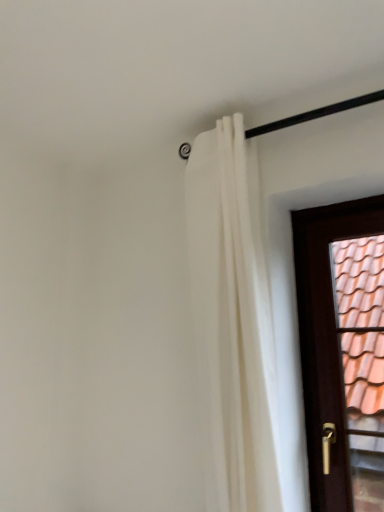
Where is `white fabric curtain at upper center`? Image resolution: width=384 pixels, height=512 pixels. white fabric curtain at upper center is located at coordinates (244, 329).

Describe the element at coordinates (244, 329) in the screenshot. This screenshot has width=384, height=512. I see `white fabric curtain at upper center` at that location.

What is the approximate width of white fabric curtain at upper center?

4.47 inches.

The width and height of the screenshot is (384, 512). In order to click on brown wooden door at right in this screenshot , I will do `click(342, 350)`.

The width and height of the screenshot is (384, 512). What do you see at coordinates (342, 350) in the screenshot?
I see `brown wooden door at right` at bounding box center [342, 350].

The height and width of the screenshot is (512, 384). I want to click on white fabric curtain at upper center, so click(244, 329).

Considering the positions of objects white fabric curtain at upper center and brown wooden door at right in the image provided, who is more to the left, white fabric curtain at upper center or brown wooden door at right?

Positioned to the left is white fabric curtain at upper center.

Does white fabric curtain at upper center come behind brown wooden door at right?

No, it is in front of brown wooden door at right.

Considering the points (279, 361) and (345, 278), which point is in front, point (279, 361) or point (345, 278)?

Positioned in front is point (279, 361).

From the image's perspective, between white fabric curtain at upper center and brown wooden door at right, who is located below?

brown wooden door at right.

From a real-world perspective, which object rests below the other?

brown wooden door at right is physically lower.

Does white fabric curtain at upper center have a greater width compared to brown wooden door at right?

Correct, the width of white fabric curtain at upper center exceeds that of brown wooden door at right.

Who is shorter, white fabric curtain at upper center or brown wooden door at right?

brown wooden door at right is shorter.

Which of these two, white fabric curtain at upper center or brown wooden door at right, is smaller?

Smaller between the two is brown wooden door at right.

Based on the photo, is brown wooden door at right located within white fabric curtain at upper center?

No, brown wooden door at right is not surrounded by white fabric curtain at upper center.

Is white fabric curtain at upper center not close to brown wooden door at right?

Yes.

Does white fabric curtain at upper center turn towards brown wooden door at right?

No, white fabric curtain at upper center is not facing towards brown wooden door at right.

How different are the orientations of white fabric curtain at upper center and brown wooden door at right in degrees?

2.18 degrees separate the facing orientations of white fabric curtain at upper center and brown wooden door at right.

There is a brown wooden door at right. Where is `curtain above it (from a real-world perspective)`? Image resolution: width=384 pixels, height=512 pixels. curtain above it (from a real-world perspective) is located at coordinates (244, 329).

Can you confirm if brown wooden door at right is positioned to the right of white fabric curtain at upper center?

Correct, you'll find brown wooden door at right to the right of white fabric curtain at upper center.

Which object is closer to the camera taking this photo, brown wooden door at right or white fabric curtain at upper center?

white fabric curtain at upper center.

Does point (321, 232) appear closer or farther from the camera than point (267, 240)?

Clearly, point (321, 232) is more distant from the camera than point (267, 240).

From the image's perspective, between brown wooden door at right and white fabric curtain at upper center, which one is located above?

From the image's view, white fabric curtain at upper center is above.

From a real-world perspective, relative to white fabric curtain at upper center, is brown wooden door at right vertically above or below?

Clearly, from a real-world perspective, brown wooden door at right is below white fabric curtain at upper center.

Can you confirm if brown wooden door at right is thinner than white fabric curtain at upper center?

Indeed, brown wooden door at right has a lesser width compared to white fabric curtain at upper center.

Between brown wooden door at right and white fabric curtain at upper center, which one has more height?

white fabric curtain at upper center.

Based on the photo, can you confirm if brown wooden door at right is bigger than white fabric curtain at upper center?

No, brown wooden door at right is not bigger than white fabric curtain at upper center.

Is brown wooden door at right not inside white fabric curtain at upper center?

That's correct, brown wooden door at right is outside of white fabric curtain at upper center.

Are brown wooden door at right and white fabric curtain at upper center far apart?

brown wooden door at right is positioned a significant distance from white fabric curtain at upper center.

Is white fabric curtain at upper center at the back of brown wooden door at right?

brown wooden door at right does not have its back to white fabric curtain at upper center.

What's the angular difference between brown wooden door at right and white fabric curtain at upper center's facing directions?

There is a 2.18-degree angle between the facing directions of brown wooden door at right and white fabric curtain at upper center.

Locate an element on the screen. door on the right of white fabric curtain at upper center is located at coordinates (342, 350).

Locate an element on the screen. This screenshot has width=384, height=512. curtain that appears on the left of brown wooden door at right is located at coordinates (244, 329).

Locate an element on the screen. This screenshot has width=384, height=512. door behind the white fabric curtain at upper center is located at coordinates (342, 350).